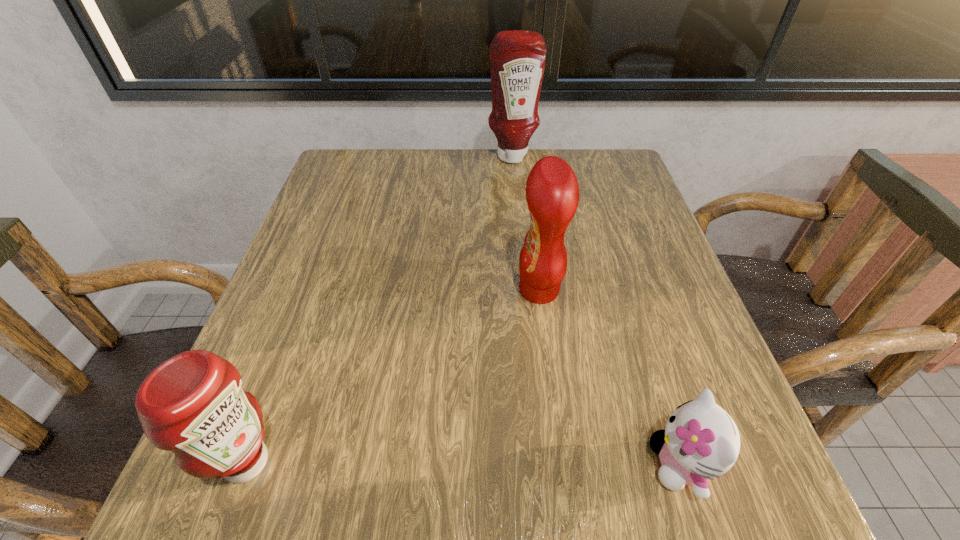
Locate an element on the screen. Image resolution: width=960 pixels, height=540 pixels. empty location between the nearest condiment and the second tallest condiment is located at coordinates (393, 376).

You are a GUI agent. You are given a task and a screenshot of the screen. Output one action in this format:
    pyautogui.click(x=<x>, y=<y>)
    Task: Click on the free space that is in between the second nearest condiment and the farthest condiment
    
    Given the screenshot: What is the action you would take?
    pyautogui.click(x=525, y=223)

This screenshot has width=960, height=540. I want to click on free point between the tallest object and the second nearest condiment, so click(525, 223).

At what (x,y) coordinates should I click in order to perform the action: click on blank region between the shortest object and the farthest condiment. Please return your answer as a coordinate pair (x, y). This screenshot has height=540, width=960. Looking at the image, I should click on (596, 310).

Where is `vacant area that lies between the rightmost object and the third tallest object`? The width and height of the screenshot is (960, 540). vacant area that lies between the rightmost object and the third tallest object is located at coordinates (464, 463).

At what (x,y) coordinates should I click in order to perform the action: click on free space that is in between the leftmost condiment and the third nearest object. Please return your answer as a coordinate pair (x, y). Looking at the image, I should click on (393, 376).

The height and width of the screenshot is (540, 960). Find the location of `empty space that is in between the farthest condiment and the shortest object`. empty space that is in between the farthest condiment and the shortest object is located at coordinates tap(596, 310).

This screenshot has height=540, width=960. I want to click on vacant area that lies between the leftmost condiment and the kitten, so click(464, 463).

Find the location of a particular element. The image size is (960, 540). free space that is in between the third nearest object and the kitten is located at coordinates (610, 377).

Where is `the second closest object to the second farthest condiment`? This screenshot has height=540, width=960. the second closest object to the second farthest condiment is located at coordinates (517, 58).